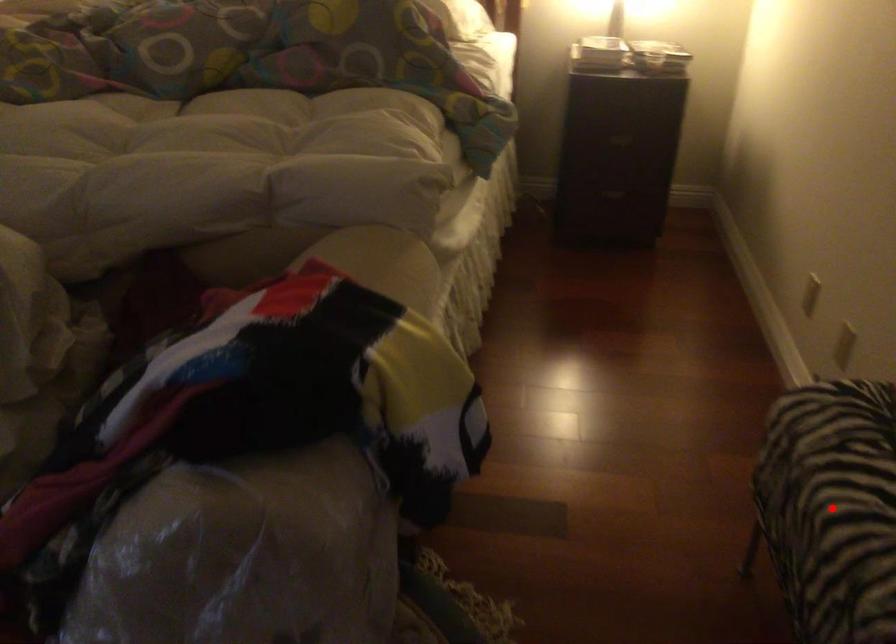
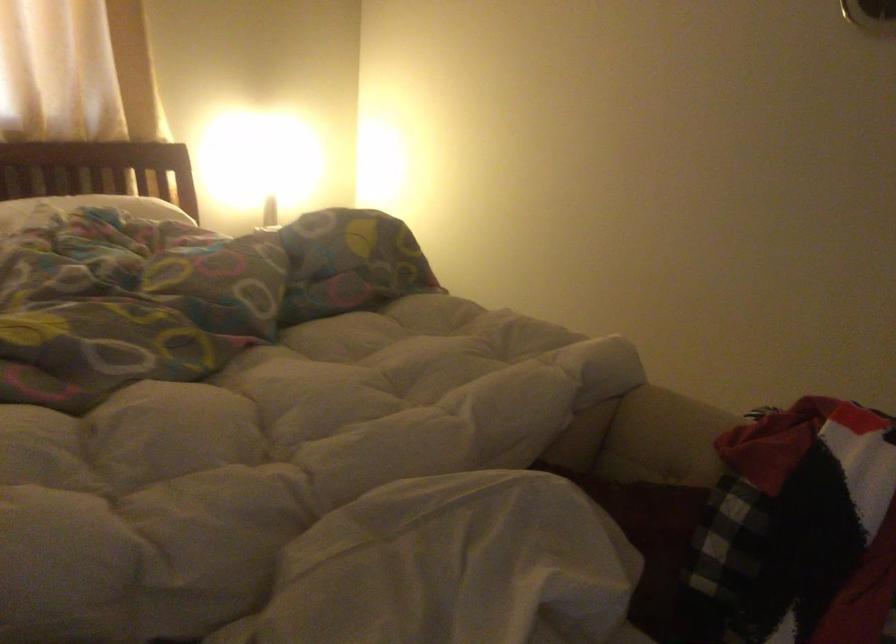
Question: I am providing you with two images of the same scene from different viewpoints. A red point is marked on the first image. Can you still see the location of the red point in image 2?

Choices:
 (A) Yes
 (B) No

Answer: (B)